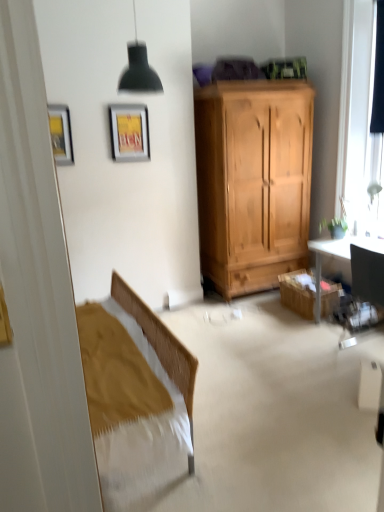
Question: Is black fabric curtain at right taller or shorter than metallic silver picture frame at upper center, which is the second picture frame from front to back?

Choices:
 (A) tall
 (B) short

Answer: (A)

Question: Is black fabric curtain at right wider or thinner than metallic silver picture frame at upper center, placed as the first picture frame when sorted from right to left?

Choices:
 (A) wide
 (B) thin

Answer: (B)

Question: Which object is positioned farthest from the black fabric curtain at right?

Choices:
 (A) matte black lampshade at upper center
 (B) metallic gold picture frame at upper left, the second picture frame from the right
 (C) wooden cabinet at lower right
 (D) metallic silver picture frame at upper center, which is the second picture frame from front to back
 (E) transparent glass window at upper right

Answer: (B)

Question: Which of these objects is positioned farthest from the wooden cabinet at lower right?

Choices:
 (A) black fabric curtain at right
 (B) matte black lampshade at upper center
 (C) metallic silver picture frame at upper center, which is the second picture frame from front to back
 (D) transparent glass window at upper right
 (E) metallic gold picture frame at upper left, marked as the 1th picture frame in a front-to-back arrangement

Answer: (E)